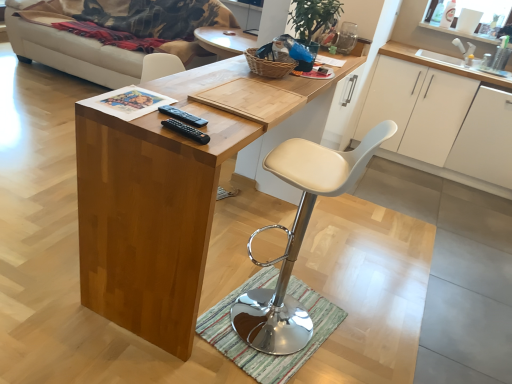
The image size is (512, 384). Find the location of `free spot below wooden desk at center (from a real-world perspective)`. free spot below wooden desk at center (from a real-world perspective) is located at coordinates [x=230, y=242].